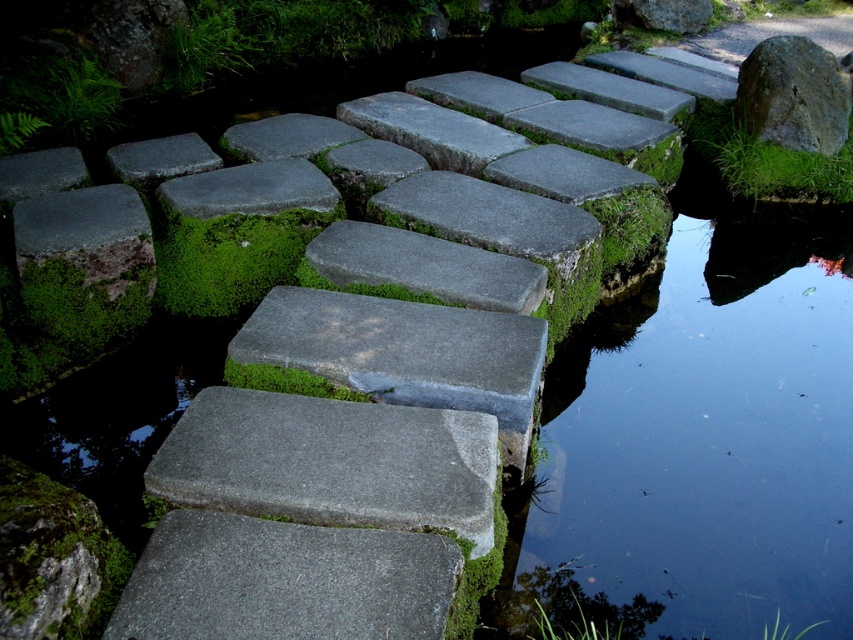
You are standing on the bank of the pond and want to reach the green mossy stone at center without getting your shoes wet. The distance between you and the stone is 3.00 meters. If you can jump 2.5 meters, will you be able to reach the stone in one jump?

The distance between you and the green mossy stone at center is 3.00 meters. Since your jump can only reach 2.5 meters, you will not be able to reach the stone in one jump without getting wet.